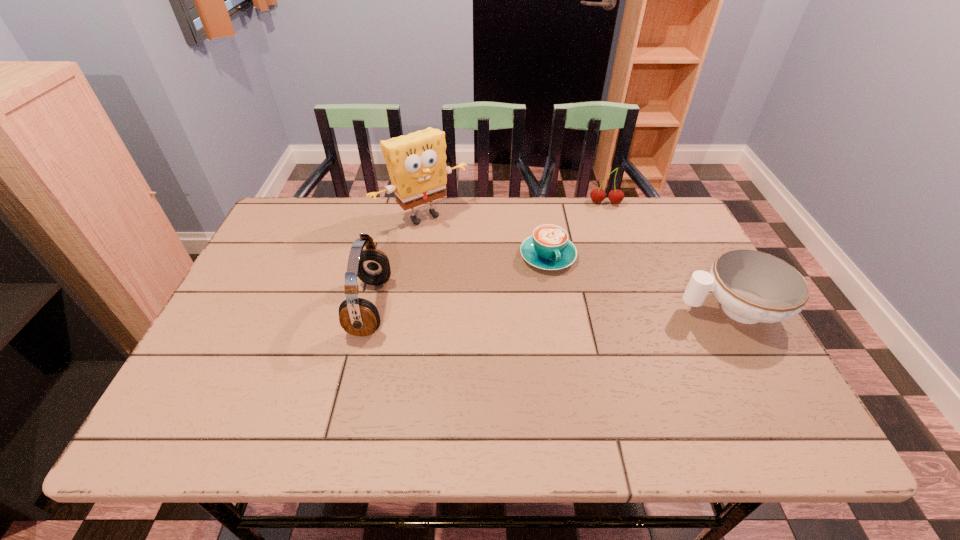
The width and height of the screenshot is (960, 540). I want to click on free region that satisfies the following two spatial constraints: 1. on the back side of the cherry; 2. on the left side of the sponge, so click(425, 203).

What are the coordinates of `free point that satisfies the following two spatial constraints: 1. on the front side of the chinaware; 2. on the side with the handle of the sponge` in the screenshot? It's located at (408, 309).